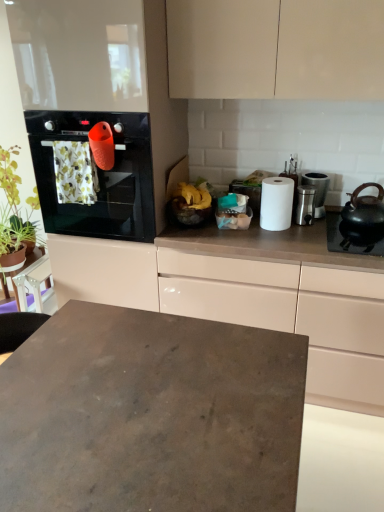
In order to click on free location in front of satin silver canister at right, which is the 1th appliance from right to left in this screenshot , I will do `click(317, 228)`.